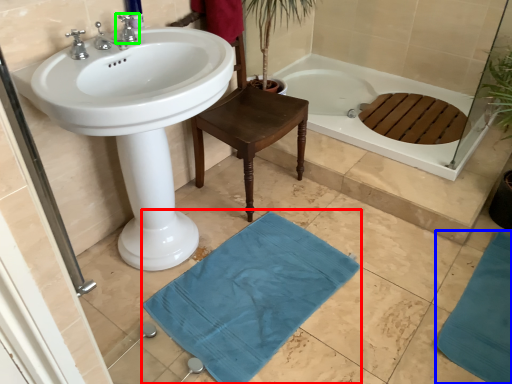
Question: Considering the real-world distances, which object is farthest from bath mat (highlighted by a red box)? bath mat (highlighted by a blue box) or tap (highlighted by a green box)?

Choices:
 (A) bath mat
 (B) tap

Answer: (B)